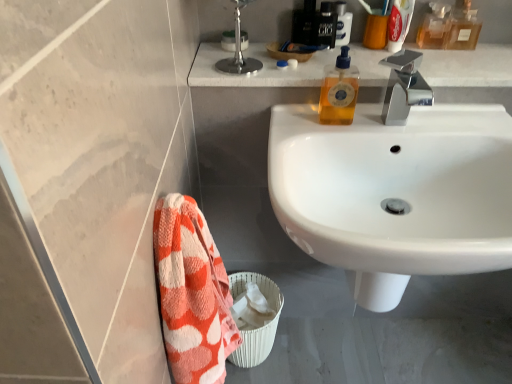
Locate an element on the screen. vacant area that is in front of black plastic soap dispenser at upper right, the third toiletry positioned from the bottom is located at coordinates pos(367,62).